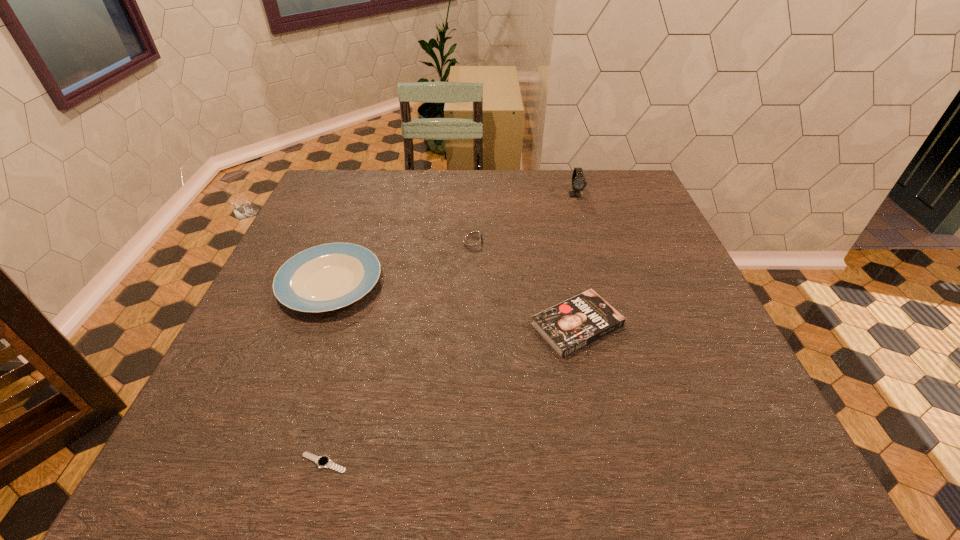
Identify the location of free space at the far left corner of the desktop. The height and width of the screenshot is (540, 960). (336, 182).

Where is `free space at the near right corner`? Image resolution: width=960 pixels, height=540 pixels. free space at the near right corner is located at coordinates (717, 477).

Find the location of a particular element. free space between the rightmost watch and the book is located at coordinates (576, 260).

Locate an element on the screen. Image resolution: width=960 pixels, height=540 pixels. free spot between the nearest watch and the book is located at coordinates (450, 394).

The image size is (960, 540). I want to click on free spot between the plate and the shortest object, so click(x=327, y=373).

Identify the location of vacant space that's between the tallest object and the shortest watch. The height and width of the screenshot is (540, 960). (450, 329).

At what (x,y) coordinates should I click in order to perform the action: click on vacant area that lies between the nearest watch and the plate. Please return your answer as a coordinate pair (x, y). Looking at the image, I should click on (327, 373).

Locate an element on the screen. blank region between the third object from right to left and the shortest object is located at coordinates (398, 352).

Identify the location of vacant space that is in between the book and the tallest watch. Image resolution: width=960 pixels, height=540 pixels. (576, 260).

At what (x,y) coordinates should I click in order to perform the action: click on vacant area between the book and the nearest watch. Please return your answer as a coordinate pair (x, y). The height and width of the screenshot is (540, 960). Looking at the image, I should click on coord(450,394).